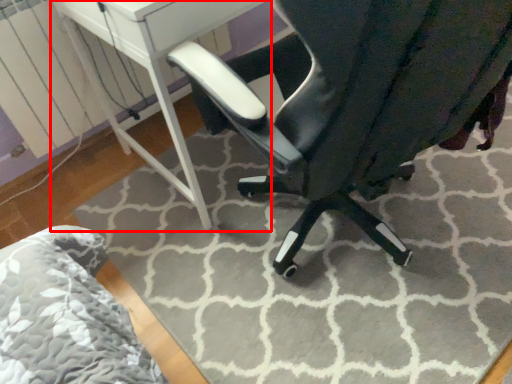
Question: From the image, what is the correct spatial relationship of table (annotated by the red box) in relation to chair?

Choices:
 (A) left
 (B) right

Answer: (A)